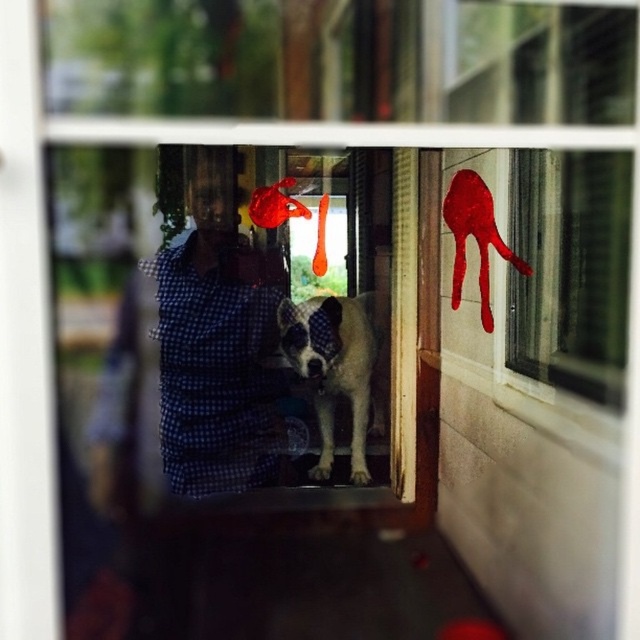
Question: Can you confirm if transparent glass window at upper right is smaller than white fur dog at center?

Choices:
 (A) yes
 (B) no

Answer: (B)

Question: Is transparent glass window at upper right to the right of white fur dog at center from the viewer's perspective?

Choices:
 (A) yes
 (B) no

Answer: (A)

Question: Which object is positioned closest to the smooth glossy paw print at upper right?

Choices:
 (A) white fur dog at center
 (B) blue checkered shirt at center
 (C) transparent glass window at upper right

Answer: (C)

Question: Estimate the real-world distances between objects in this image. Which object is farther from the blue checkered shirt at center?

Choices:
 (A) smooth glossy paw print at upper right
 (B) white fur dog at center

Answer: (A)

Question: Estimate the real-world distances between objects in this image. Which object is farther from the white fur dog at center?

Choices:
 (A) transparent glass window at upper right
 (B) smooth glossy paw print at upper right
 (C) blue checkered shirt at center

Answer: (A)

Question: Can you confirm if blue checkered shirt at center is positioned to the right of white fur dog at center?

Choices:
 (A) yes
 (B) no

Answer: (B)